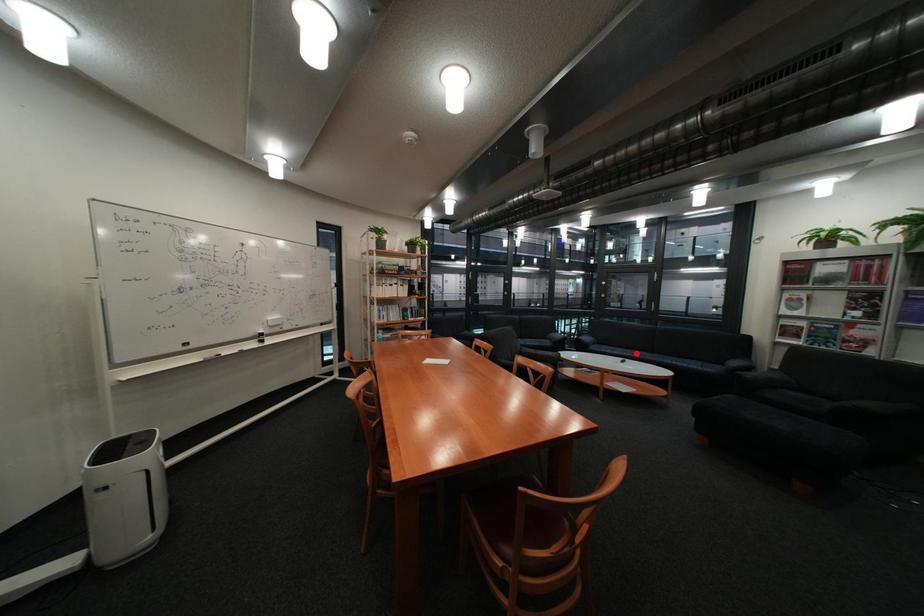
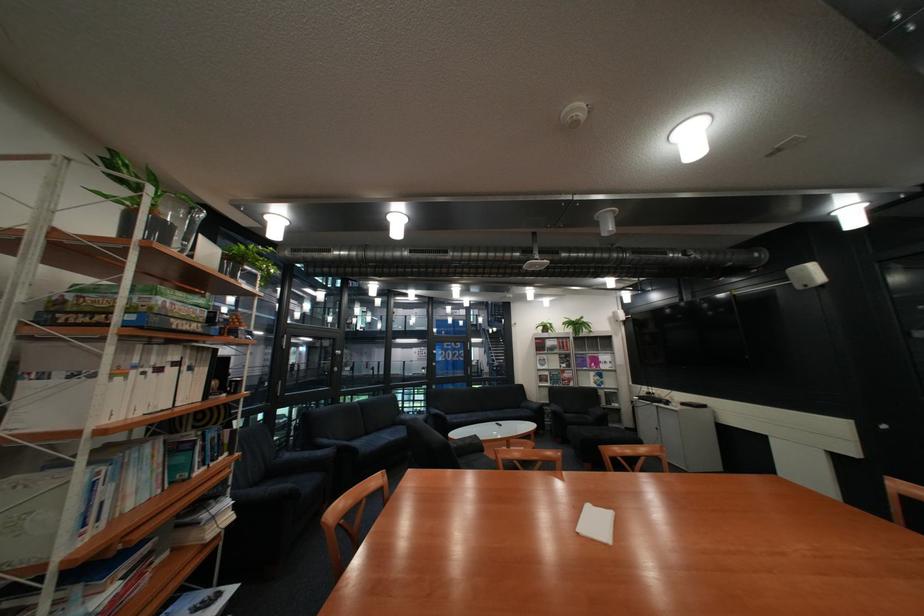
Question: I am providing you with two images of the same scene from different viewpoints. Given a red point in image1, look at the same physical point in image2. Is it:

Choices:
 (A) Closer to the viewpoint
 (B) Farther from the viewpoint

Answer: (A)